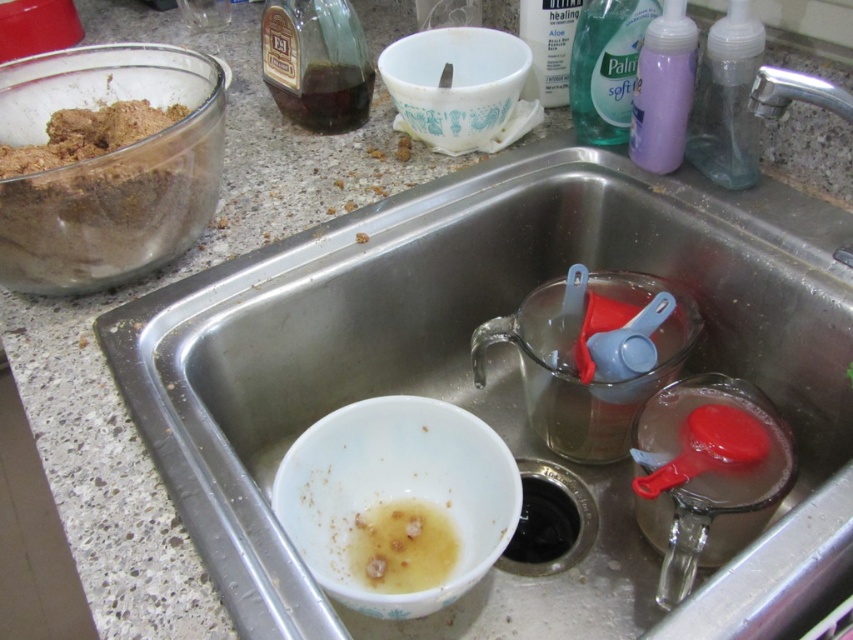
You are a baker preparing ingredients for a recipe. You have a white glossy bowl at sink bottom and a brown matte bowl at lower left. Which bowl should you use if you need a larger container for mixing dough?

The white glossy bowl at sink bottom is larger in size compared to the brown matte bowl at lower left, so you should use the white glossy bowl at sink bottom for mixing dough.

You are a chef preparing ingredients in the kitchen. You need to move the white glossy bowl at lower left to a higher position so it doesn t spill. Can you place it above the white ceramic bowl at upper center?

The white glossy bowl at lower left is located below the white ceramic bowl at upper center. Since the white ceramic bowl at upper center is already above it, you cannot place the white glossy bowl at lower left above the white ceramic bowl at upper center because it is already positioned below.